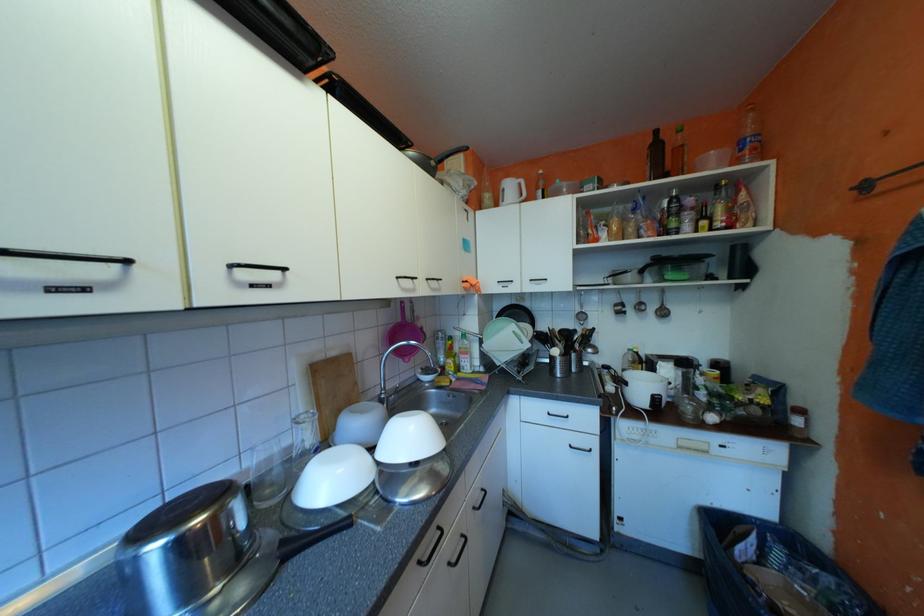
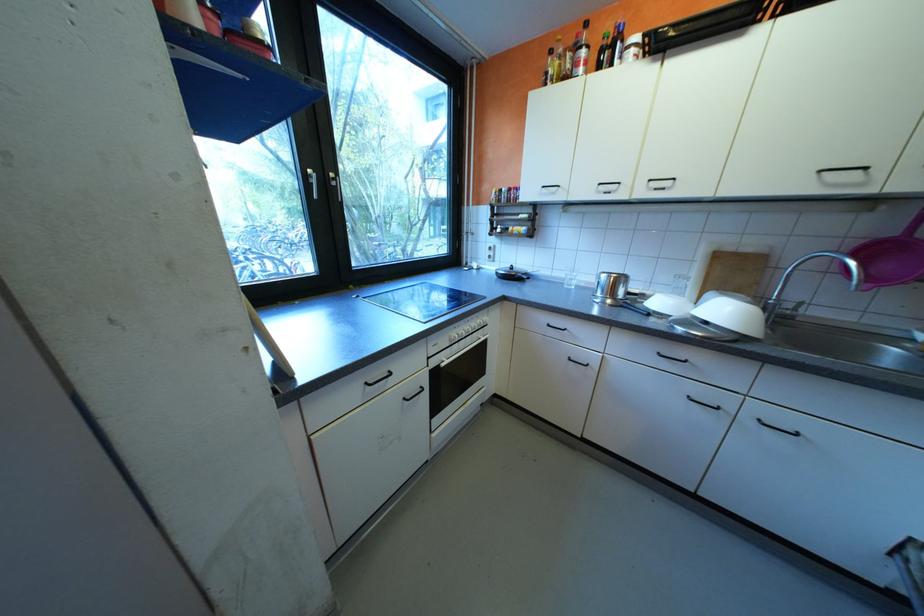
Locate, in the second image, the point that corresponds to (423,435) in the first image.

(736, 312)